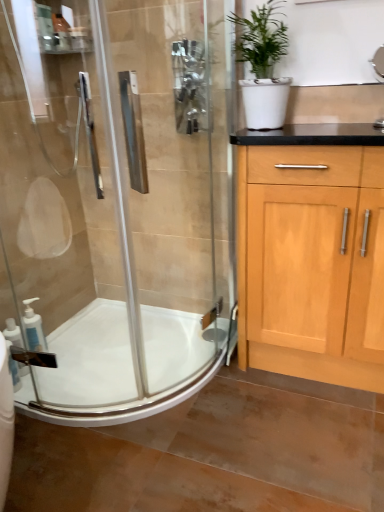
Question: In the image, is white matte soap dispenser at lower left, the 1th soap dispenser positioned from the back, positioned in front of or behind white glossy soap dispenser at lower left, placed as the 1th soap dispenser when sorted from front to back?

Choices:
 (A) front
 (B) behind

Answer: (B)

Question: Is point (26, 321) closer or farther from the camera than point (18, 373)?

Choices:
 (A) farther
 (B) closer

Answer: (A)

Question: Which object is the farthest from the white matte soap dispenser at lower left, the 1th soap dispenser positioned from the back?

Choices:
 (A) white glossy sink at upper right
 (B) white glossy soap dispenser at lower left, the second soap dispenser in the back-to-front sequence
 (C) white matte pot at upper right
 (D) white glossy bath at lower left
 (E) clear glass shower door at left

Answer: (A)

Question: Estimate the real-world distances between objects in this image. Which object is closer to the white glossy soap dispenser at lower left, the second soap dispenser in the back-to-front sequence?

Choices:
 (A) white glossy sink at upper right
 (B) white glossy bath at lower left
 (C) white matte pot at upper right
 (D) clear glass shower door at left
 (E) white matte soap dispenser at lower left, the 1th soap dispenser positioned from the back

Answer: (E)